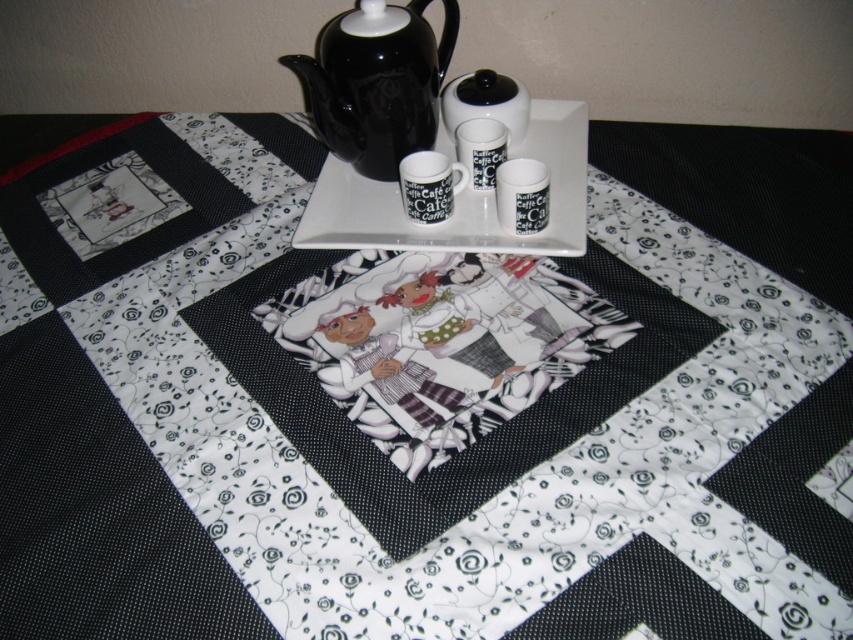
Question: Among these objects, which one is farthest from the camera?

Choices:
 (A) white glossy platter at upper center
 (B) black ceramic teapot at upper center

Answer: (B)

Question: Can you confirm if black ceramic teapot at upper center is positioned to the left of white glossy platter at upper center?

Choices:
 (A) yes
 (B) no

Answer: (A)

Question: Does black ceramic teapot at upper center appear on the right side of white glossy platter at upper center?

Choices:
 (A) no
 (B) yes

Answer: (A)

Question: Does black ceramic teapot at upper center come behind white glossy platter at upper center?

Choices:
 (A) no
 (B) yes

Answer: (B)